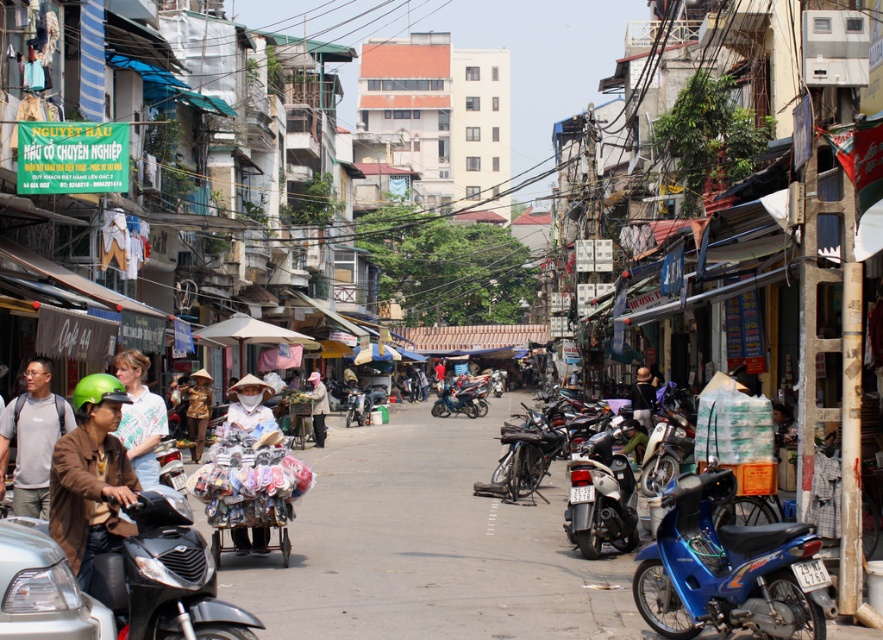
Question: Is white fabric cart at center thinner than shiny blue motorcycle at center?

Choices:
 (A) yes
 (B) no

Answer: (A)

Question: Among these objects, which one is farthest from the camera?

Choices:
 (A) blue metallic motorcycle at lower right
 (B) white cotton shirt at center
 (C) shiny blue motorcycle at center

Answer: (C)

Question: Can you confirm if shiny chrome motorcycle at center is thinner than light brown fabric cart at center?

Choices:
 (A) yes
 (B) no

Answer: (A)

Question: Is matte gray shirt at center positioned at the back of light brown fabric cart at center?

Choices:
 (A) yes
 (B) no

Answer: (B)

Question: Which of these objects is positioned closest to the shiny metallic motorcycle at center?

Choices:
 (A) green matte helmet at left
 (B) light brown fabric cart at center
 (C) white fabric cart at center

Answer: (B)

Question: Which point is farther to the camera?

Choices:
 (A) blue metallic motorcycle at lower right
 (B) shiny blue motorcycle at center
 (C) white fabric cart at center

Answer: (B)